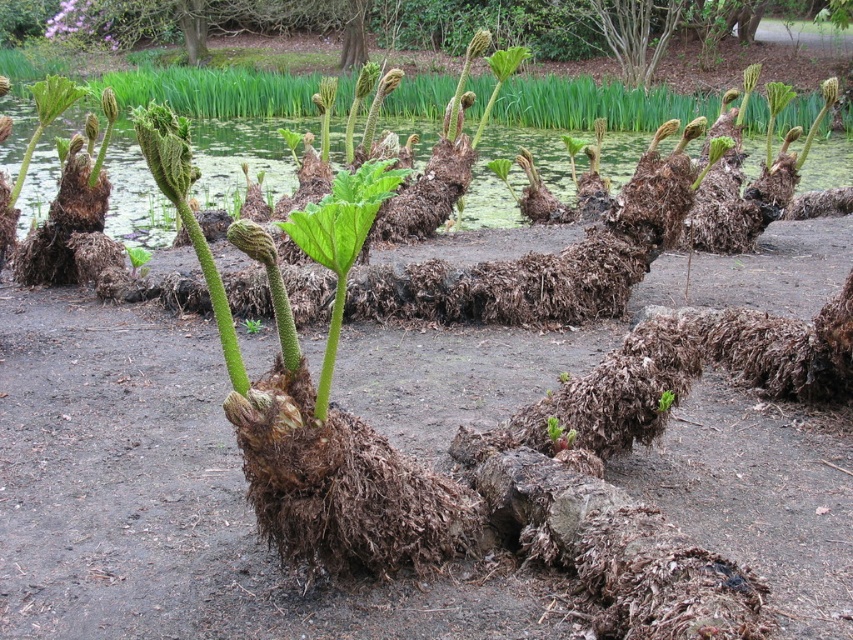
You are a gardener who wants to place a new small statue between the green mossy water at center and the green matte leafy plant at center. Which object should you place the statue closer to if you want it to be near the smaller one?

The green matte leafy plant at center is smaller than the green mossy water at center, so you should place the statue closer to the green matte leafy plant at center.

You are standing in a natural setting with a group of plants. You see the green mossy water at center and the green fuzzy fern at center. Which one is located to the left?

The green mossy water at center is positioned on the left side of green fuzzy fern at center, so the green mossy water at center is located to the left.

From the picture: You are a gardener who wants to plant both the green matte leafy plant at center and the green fuzzy fern at center in a garden bed. Considering their heights, which one should be placed in the back row to avoid blocking sunlight for the shorter plant?

The green matte leafy plant at center should be placed in the back row because it has a greater height compared to the green fuzzy fern at center, preventing it from overshadowing the shorter plant.